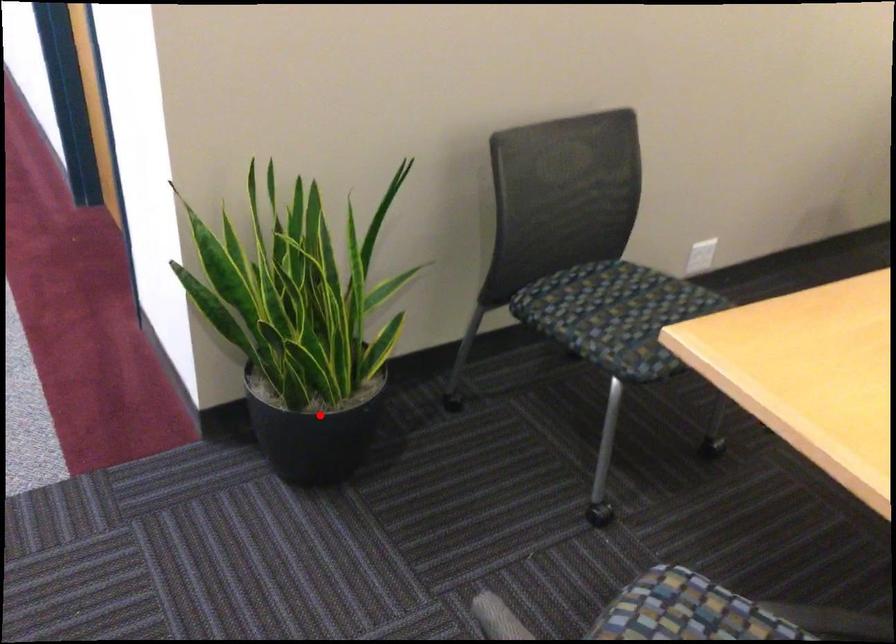
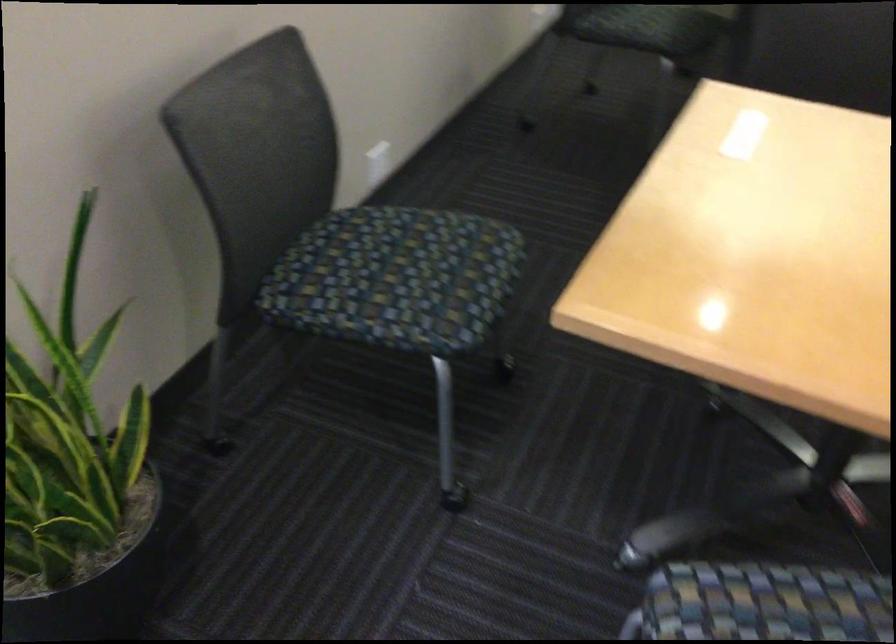
Question: I am providing you with two images of the same scene from different viewpoints. Image1 has a red point marked. In image2, the corresponding 3D location appears at what relative position? Reply with the corresponding letter.

Choices:
 (A) Closer
 (B) Farther

Answer: (A)